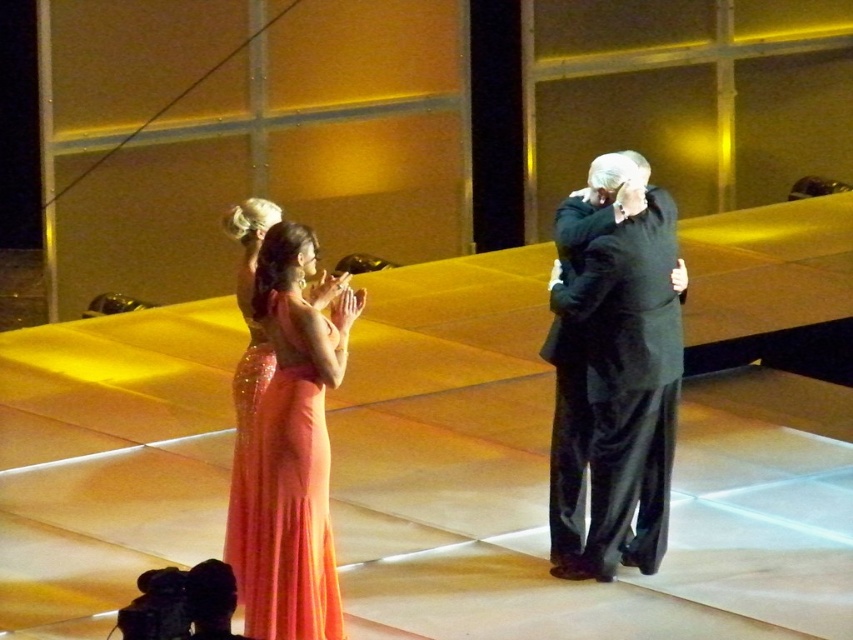
You are a stagehand preparing to place a 1.5 meter long banner between the dark gray suit at center and the shiny coral gown at center. Can the banner fit between them without overlapping either?

The dark gray suit at center and shiny coral gown at center are 1.20 meters apart. Since the banner is 1.5 meters long, it cannot fit between them without overlapping either object.

In the scene shown: You are an event planner standing on the stage and need to adjust the lighting for the dark gray suit at center and the shiny coral gown at center. Which object should you focus on first if you want to start with the one closer to you?

The dark gray suit at center is closer to you, so you should focus on adjusting the lighting for the dark gray suit at center first.

You are standing on the stage and looking at two points marked in the scene. Which point is closer to you, point (x=579, y=456) or point (x=257, y=506)?

Point (x=579, y=456) is further to the camera than point (x=257, y=506), so point (x=257, y=506) is closer to you.